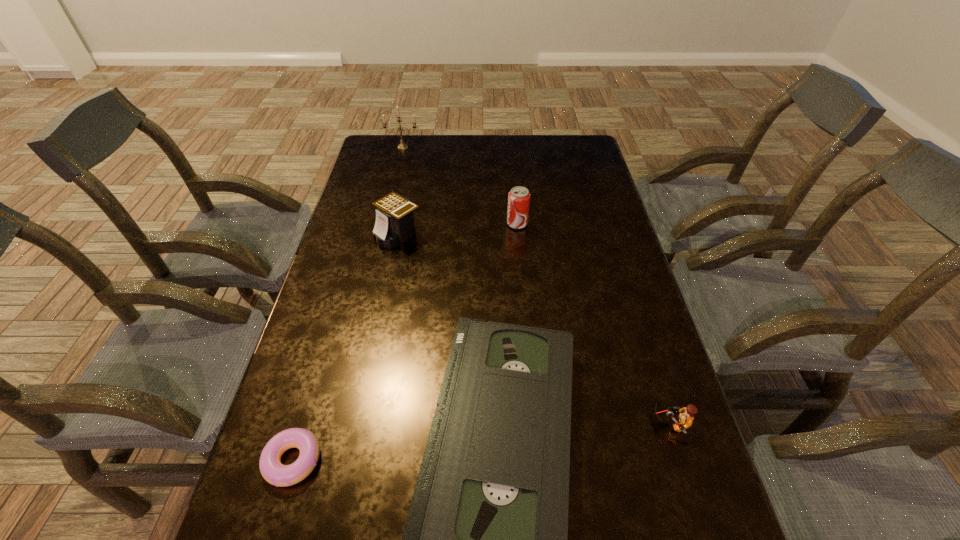
Identify which object is located as the third nearest to the shortest object. Please provide its 2D coordinates. Your answer should be formatted as a tuple, i.e. [(x, y)], where the tuple contains the x and y coordinates of a point satisfying the conditions above.

[(686, 418)]